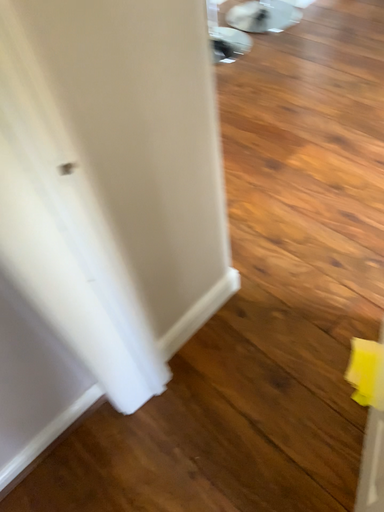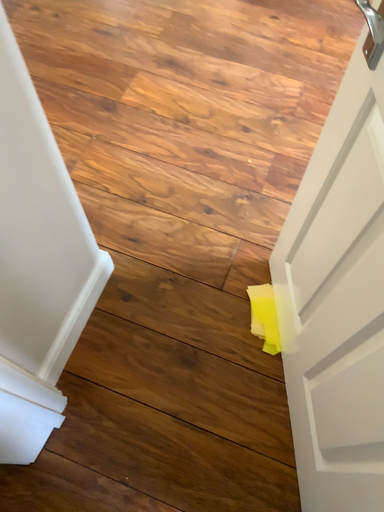
Question: Which way did the camera rotate in the video?

Choices:
 (A) rotated downward
 (B) rotated upward

Answer: (A)